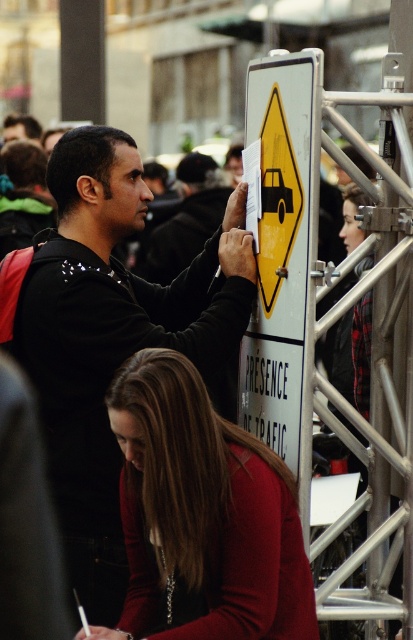
You are a photographer trying to capture a photo of the matte red sweater at lower center. To avoid including the black matte shirt at upper left in your shot, which direction should you move your camera?

The black matte shirt at upper left is to the left of the matte red sweater at lower center. To avoid including the black matte shirt at upper left, move your camera to the right side of the matte red sweater at lower center.